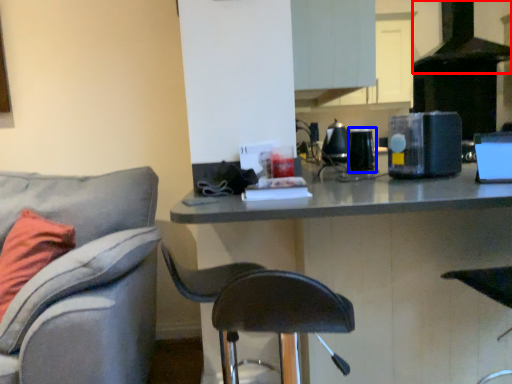
Question: Which point is further to the camera, exhaust hood (highlighted by a red box) or appliance (highlighted by a blue box)?

Choices:
 (A) exhaust hood
 (B) appliance

Answer: (A)